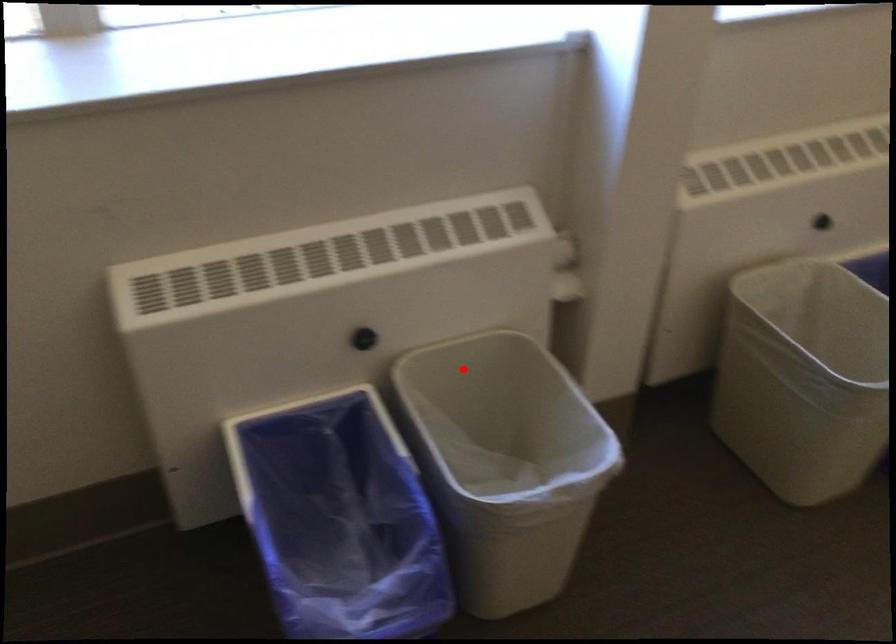
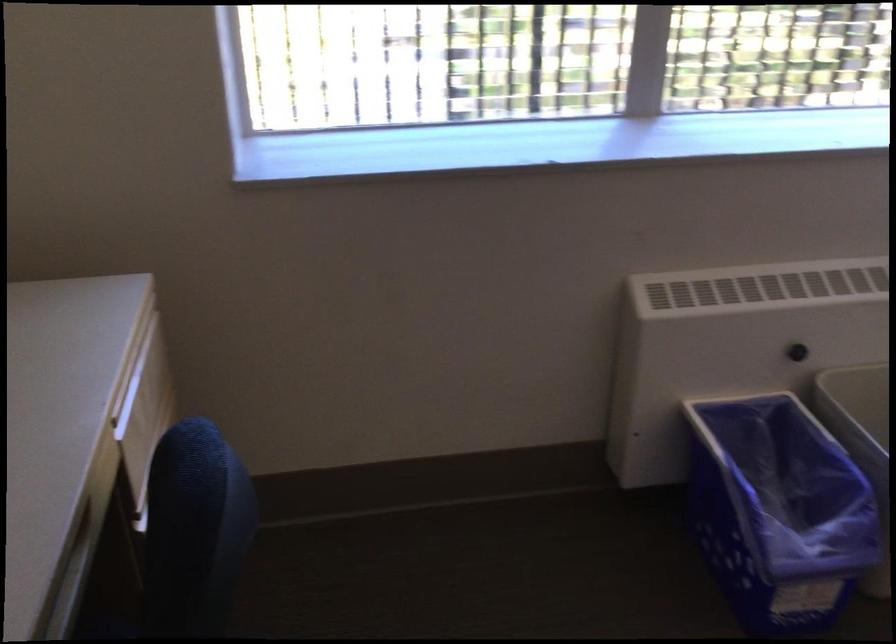
Find the pixel in the second image that matches the highlighted location in the first image.

(860, 391)